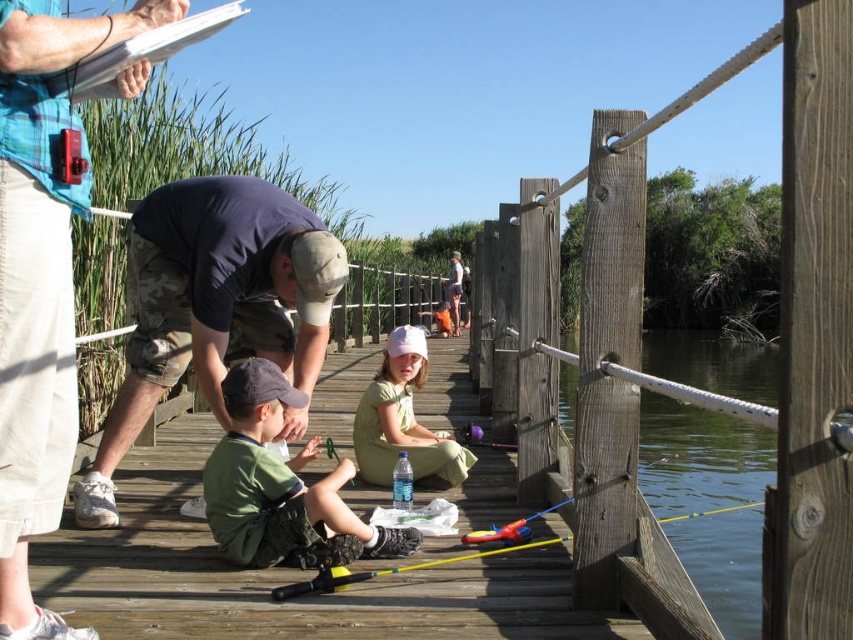
You are standing at the center of the boardwalk and want to find the camouflage pants at left. According to the scene description, where should you look relative to the boardwalk?

The camouflage pants at left is located at point 0.438 meters from the left edge and 0.050 meters from the bottom edge of the boardwalk. So you should look towards the left side, closer to the left edge of the boardwalk.